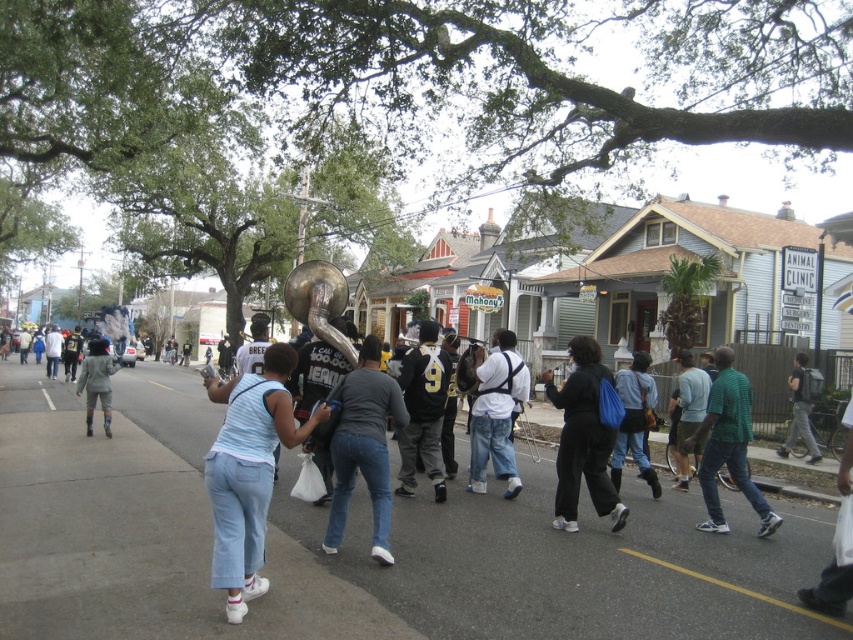
Question: Does black jersey at center have a lesser width compared to camouflage pants at center?

Choices:
 (A) yes
 (B) no

Answer: (A)

Question: Which point is closer to the camera?

Choices:
 (A) white cotton shirt at center
 (B) light gray backpack at center
 (C) denim jeans at center
 (D) gray asphalt road at center

Answer: (D)

Question: Which point appears closest to the camera in this image?

Choices:
 (A) (805, 432)
 (B) (689, 387)
 (C) (639, 465)
 (D) (123, 401)

Answer: (C)

Question: Which point appears farthest from the camera in this image?

Choices:
 (A) (x=91, y=371)
 (B) (x=422, y=461)
 (C) (x=693, y=419)
 (D) (x=546, y=380)

Answer: (D)

Question: Can you confirm if denim jeans at center is positioned below denim pants at center?

Choices:
 (A) no
 (B) yes

Answer: (A)

Question: Is green mesh shirt at center smaller than black jersey at center?

Choices:
 (A) no
 (B) yes

Answer: (A)